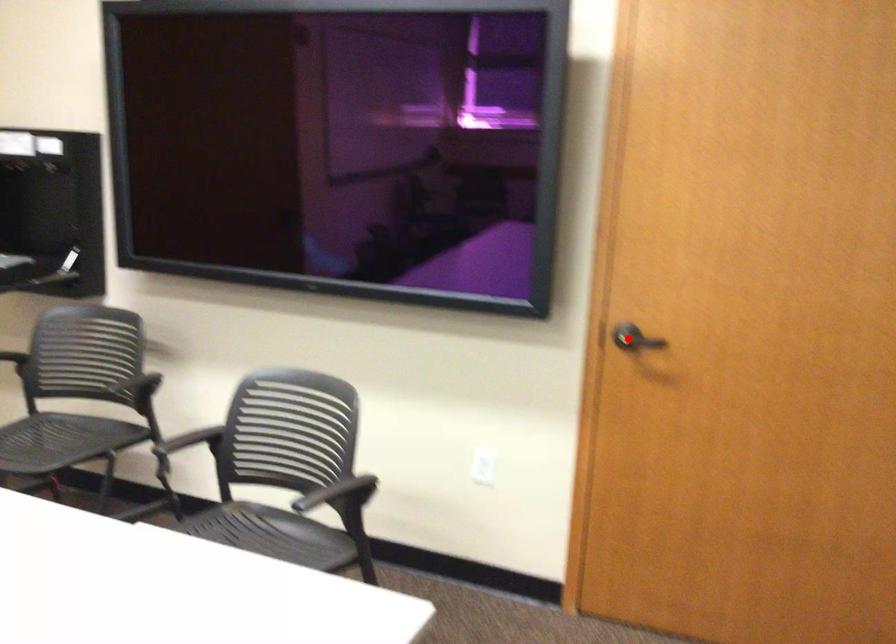
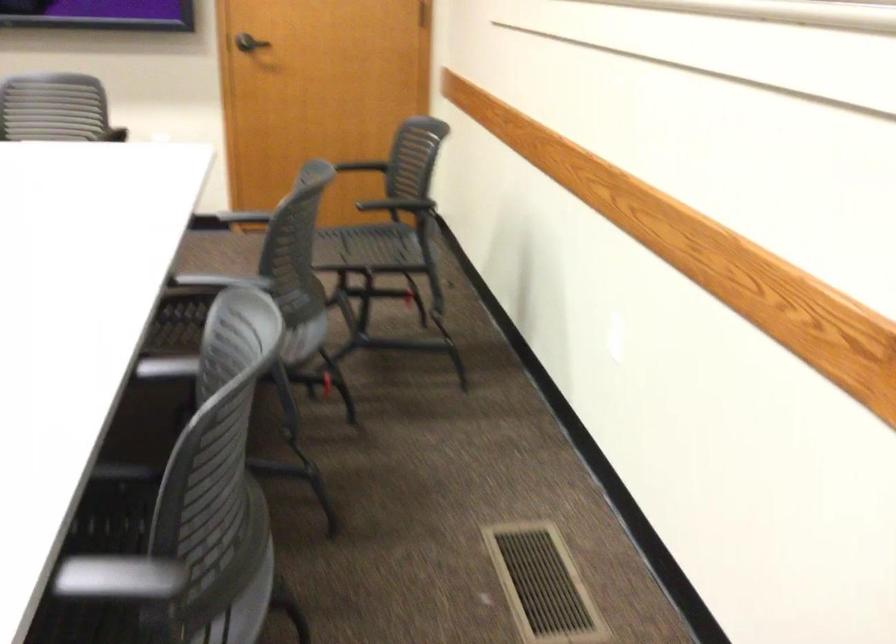
Find the pixel in the second image that matches the highlighted location in the first image.

(250, 43)